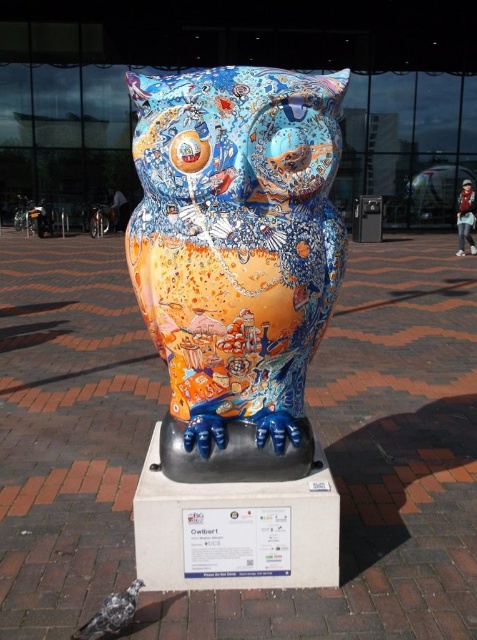
At what (x,y) coordinates should I click in order to perform the action: click on painted ceramic owl at center. Please return your answer as a coordinate pair (x, y). Image resolution: width=477 pixels, height=640 pixels. Looking at the image, I should click on pos(236,259).

Is painted ceramic owl at center thinner than speckled gray pigeon at lower left?

No, painted ceramic owl at center is not thinner than speckled gray pigeon at lower left.

What do you see at coordinates (236, 259) in the screenshot?
I see `painted ceramic owl at center` at bounding box center [236, 259].

At what (x,y) coordinates should I click in order to perform the action: click on painted ceramic owl at center. Please return your answer as a coordinate pair (x, y). Looking at the image, I should click on (236, 259).